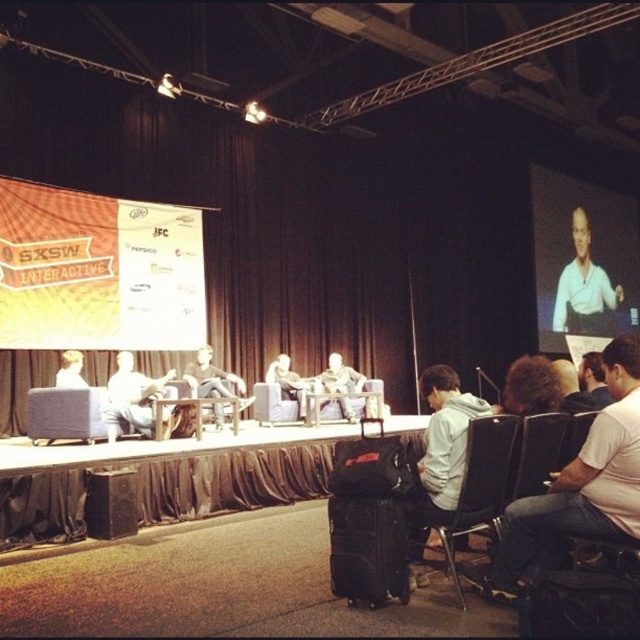
Is black plastic chair at lower right wider than white shirt at upper right?

In fact, black plastic chair at lower right might be narrower than white shirt at upper right.

Can you confirm if black plastic chair at lower right is thinner than white shirt at upper right?

Indeed, black plastic chair at lower right has a lesser width compared to white shirt at upper right.

This screenshot has width=640, height=640. In order to click on black plastic chair at lower right in this screenshot , I will do `click(476, 486)`.

Locate an element on the screen. Image resolution: width=640 pixels, height=640 pixels. black plastic chair at lower right is located at coordinates (476, 486).

Between black leather chair at lower right and light gray fabric couch at center, which one appears on the right side from the viewer's perspective?

black leather chair at lower right

Who is more distant from viewer, (538, 451) or (353, 420)?

Positioned behind is point (353, 420).

Image resolution: width=640 pixels, height=640 pixels. I want to click on black leather chair at lower right, so 538,452.

From the picture: Can you confirm if black plastic chair at lower right is smaller than light gray fabric couch at center?

Yes.

Who is lower down, black plastic chair at lower right or light gray fabric couch at center?

black plastic chair at lower right is below.

The width and height of the screenshot is (640, 640). Describe the element at coordinates (476, 486) in the screenshot. I see `black plastic chair at lower right` at that location.

Where is `black plastic chair at lower right`? This screenshot has width=640, height=640. black plastic chair at lower right is located at coordinates (476, 486).